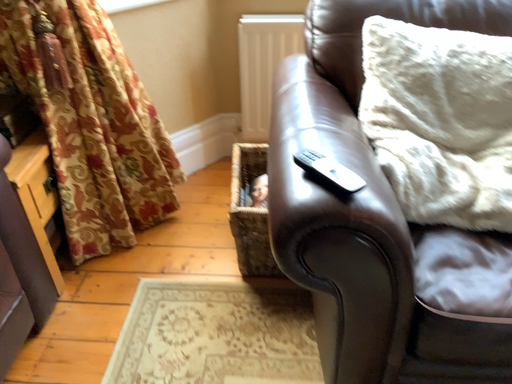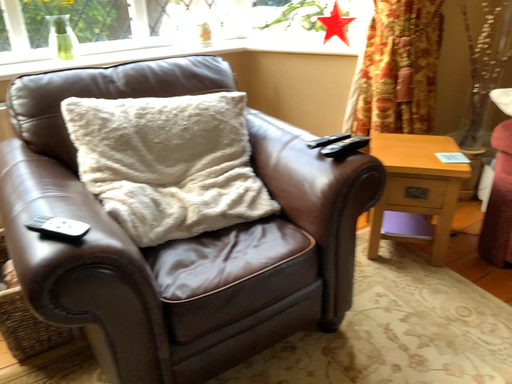
Question: How did the camera likely rotate when shooting the video?

Choices:
 (A) rotated right
 (B) rotated left

Answer: (A)